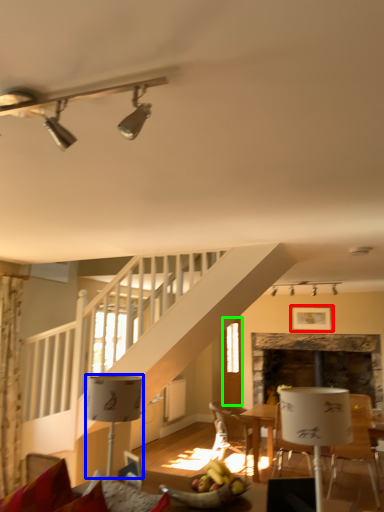
Question: Based on their relative distances, which object is farther from picture frame (highlighted by a red box)? Choose from lamp (highlighted by a blue box) and glass door (highlighted by a green box).

Choices:
 (A) lamp
 (B) glass door

Answer: (A)